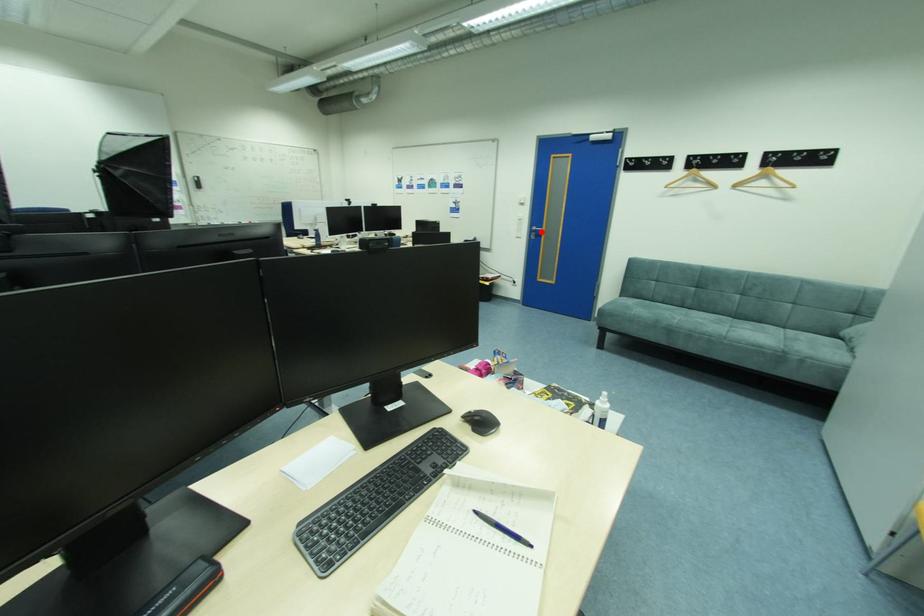
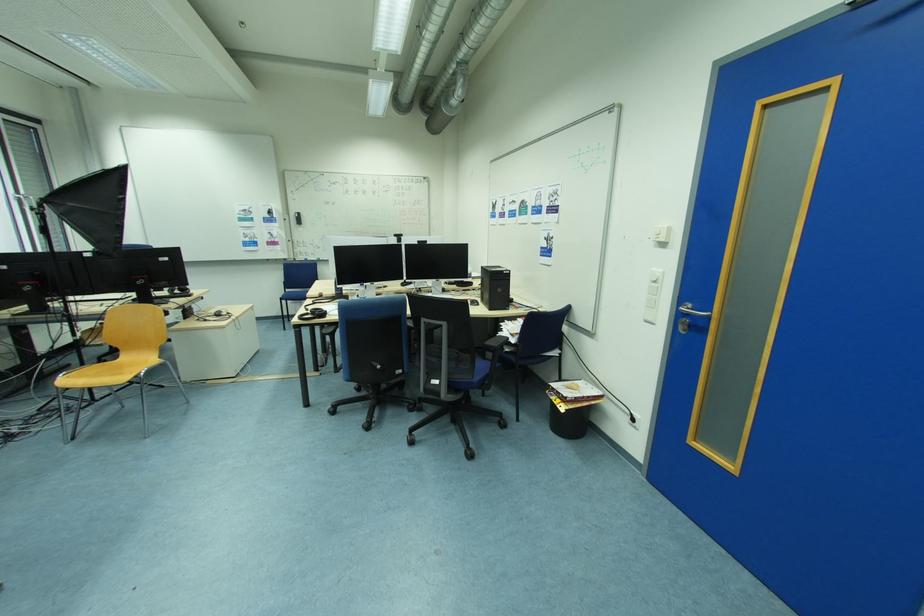
In the second image, find the point that corresponds to the highlighted location in the first image.

(695, 315)